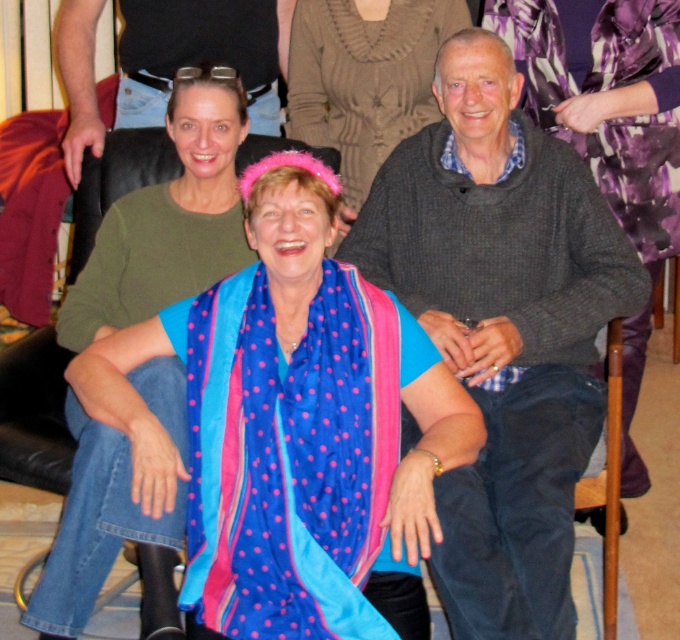
Question: Which of these objects is positioned farthest from the blue silk scarf at center?

Choices:
 (A) pink fabric headband at center
 (B) knitted gray sweater at center

Answer: (A)

Question: Which object appears closest to the camera in this image?

Choices:
 (A) pink fabric headband at center
 (B) knitted gray sweater at center

Answer: (B)

Question: Is matte green sweater at upper left below pink fabric headband at center?

Choices:
 (A) no
 (B) yes

Answer: (B)

Question: Considering the real-world distances, which object is closest to the blue silk scarf at center?

Choices:
 (A) matte green sweater at upper left
 (B) knitted gray sweater at center

Answer: (B)

Question: Can you confirm if knitted gray sweater at center is wider than blue silk scarf at center?

Choices:
 (A) no
 (B) yes

Answer: (A)

Question: Is knitted gray sweater at center wider than matte green sweater at upper left?

Choices:
 (A) yes
 (B) no

Answer: (A)